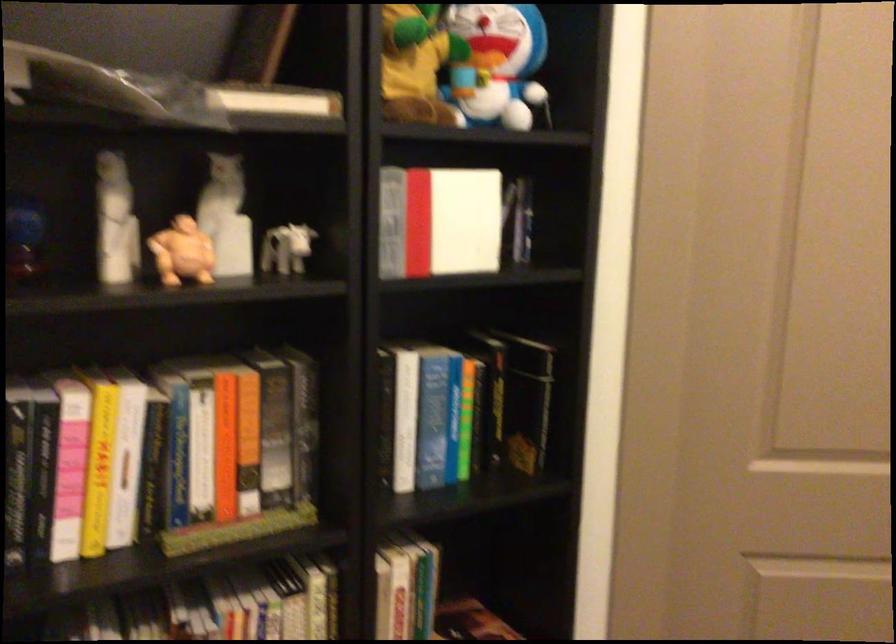
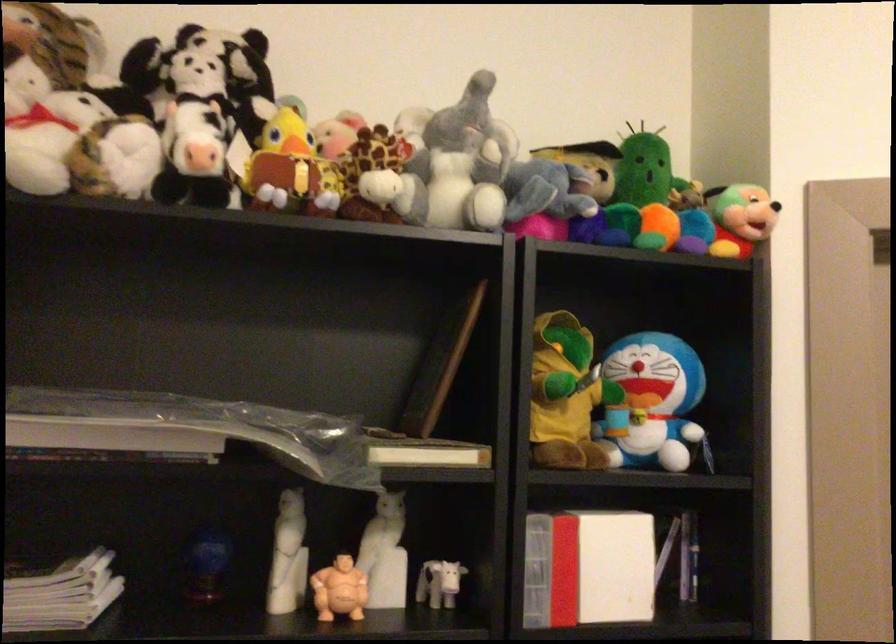
In the second image, find the point that corresponds to (116,225) in the first image.

(288, 556)